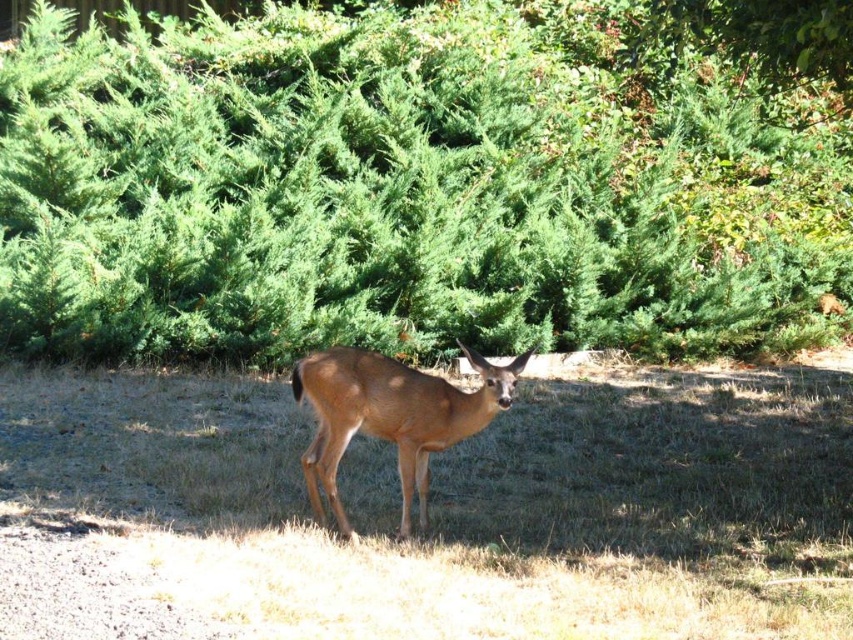
You are a photographer trying to capture the deer in the image. You want to place two markers at the points labeled point (509,33) and point (386,520). From the camera position, which marker will appear closer to the deer?

Point (386,520) will appear closer to the deer because it is in front of point (509,33) according to their spatial positions.